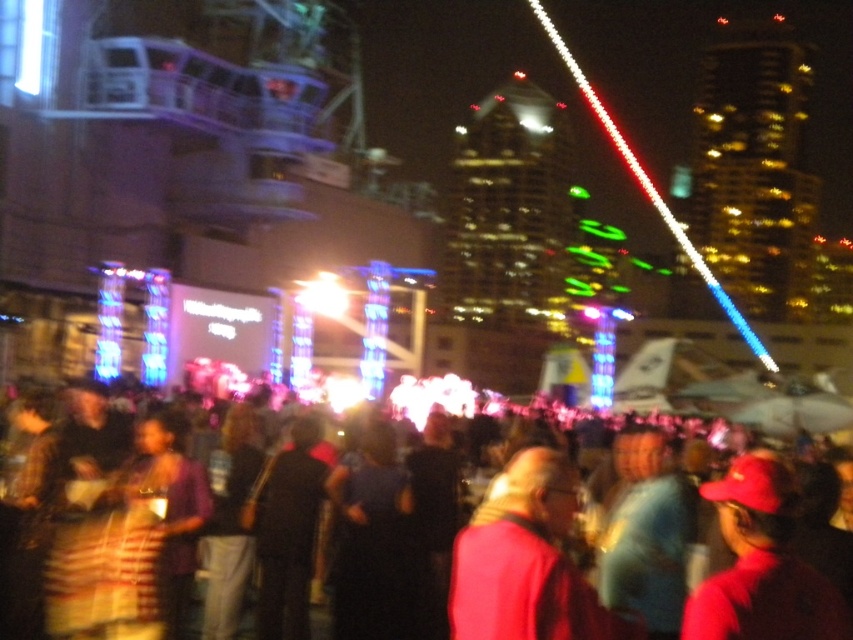
Question: Is the position of pink fabric at center less distant than that of red fabric crowd at center?

Choices:
 (A) yes
 (B) no

Answer: (B)

Question: Among these objects, which one is farthest from the camera?

Choices:
 (A) red fabric crowd at center
 (B) pink fabric at center
 (C) red matte cap at lower right

Answer: (B)

Question: Is pink fabric at center bigger than red matte cap at lower right?

Choices:
 (A) no
 (B) yes

Answer: (B)

Question: Which point is farther to the camera?

Choices:
 (A) (540, 596)
 (B) (815, 616)

Answer: (A)

Question: Can you confirm if pink fabric at center is wider than red fabric crowd at center?

Choices:
 (A) yes
 (B) no

Answer: (B)

Question: Among these points, which one is nearest to the camera?

Choices:
 (A) (566, 476)
 (B) (12, 624)
 (C) (750, 477)

Answer: (C)